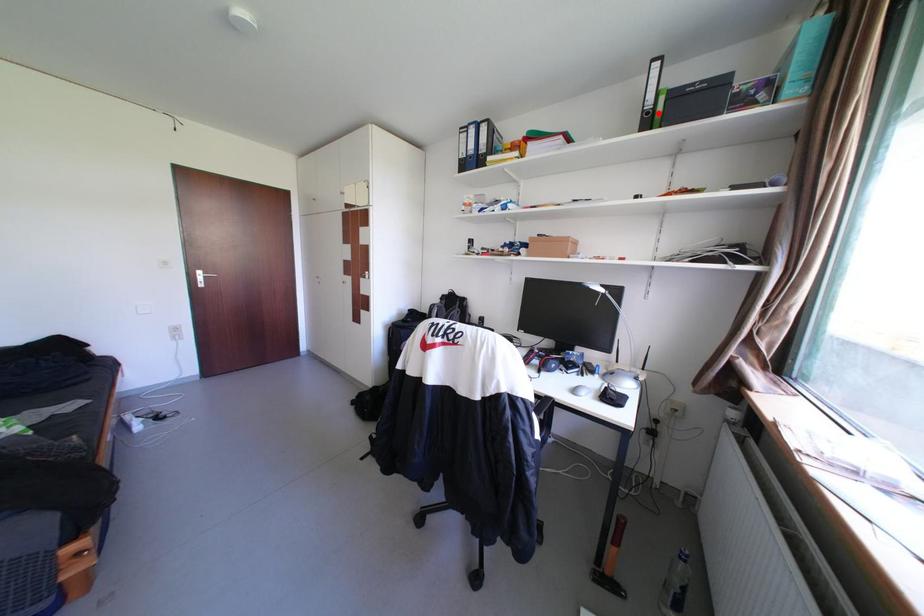
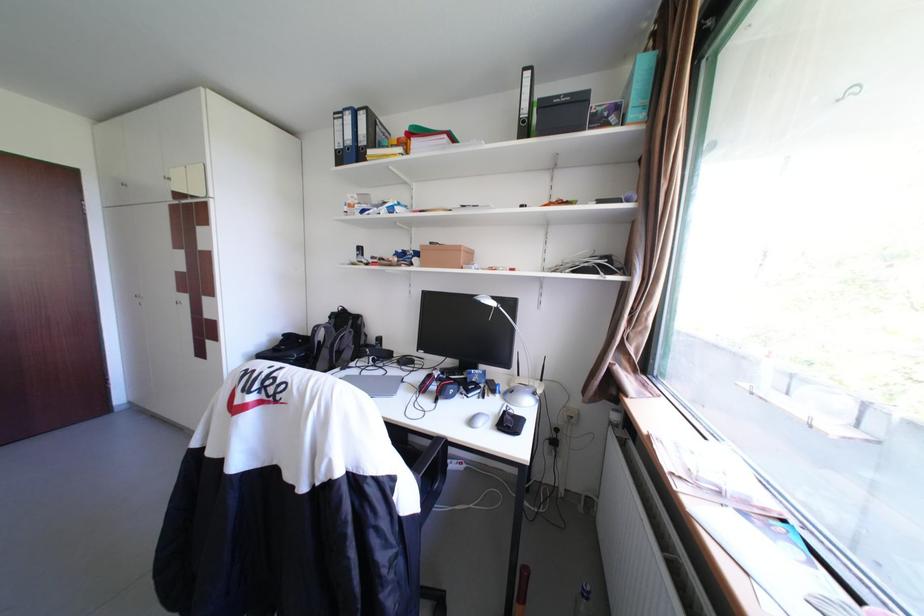
In the second image, find the point that corresponds to the highlighted location in the first image.

(535, 122)